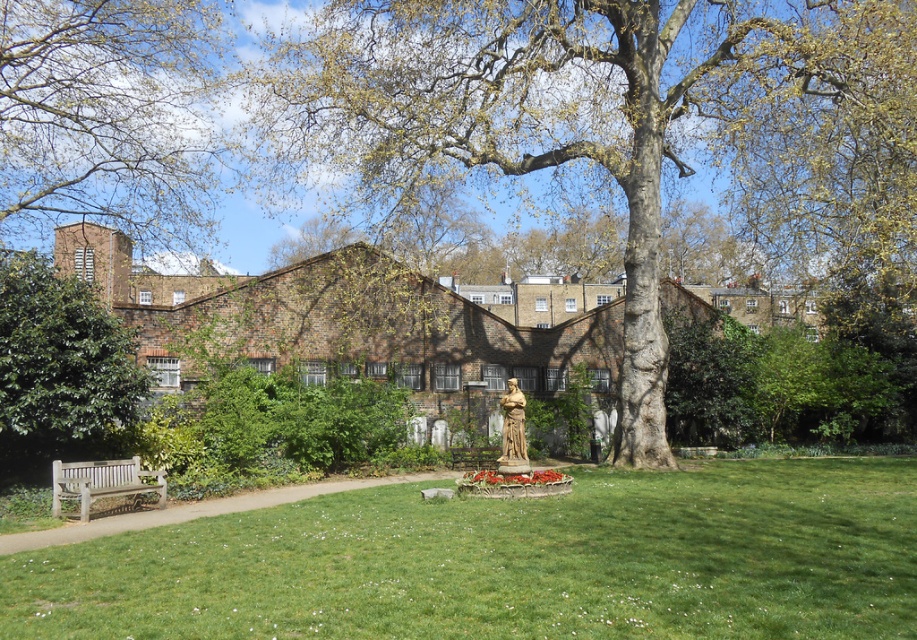
Is green leafy tree at left above stone statue at center?

Indeed, green leafy tree at left is positioned over stone statue at center.

Is point (62, 291) more distant than point (517, 424)?

No.

The image size is (917, 640). In order to click on green leafy tree at left in this screenshot , I will do `click(59, 365)`.

Can you confirm if smooth brown tree trunk at center is smaller than green leafy tree at upper left?

Actually, smooth brown tree trunk at center might be larger than green leafy tree at upper left.

Which is below, smooth brown tree trunk at center or green leafy tree at upper left?

green leafy tree at upper left is lower down.

What do you see at coordinates (627, 132) in the screenshot? The image size is (917, 640). I see `smooth brown tree trunk at center` at bounding box center [627, 132].

Locate an element on the screen. smooth brown tree trunk at center is located at coordinates (627, 132).

Who is higher up, green grassy at center or green leafy tree at left?

Positioned higher is green leafy tree at left.

Does point (291, 604) come in front of point (21, 458)?

Yes, point (291, 604) is in front of point (21, 458).

This screenshot has width=917, height=640. Identify the location of green grassy at center. (509, 563).